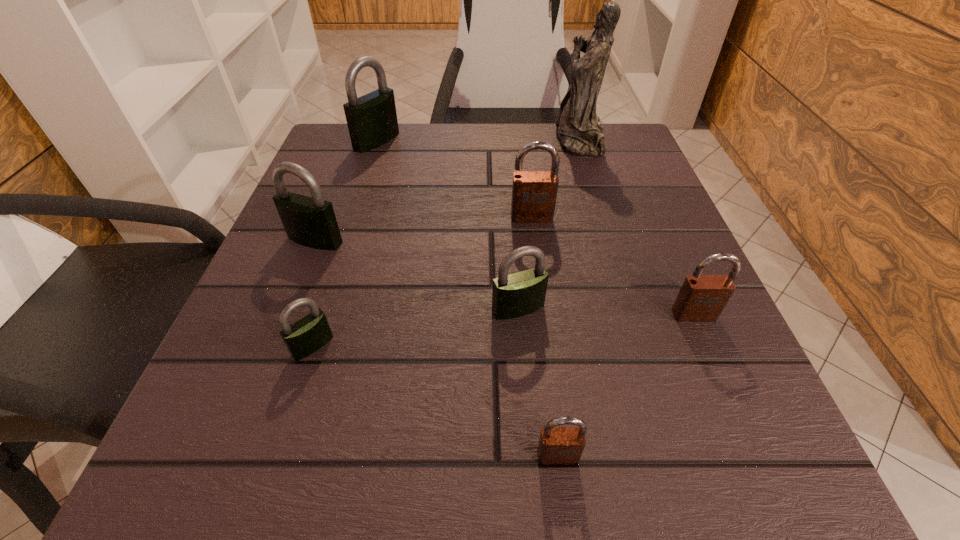
I want to click on free region located 0.240m on the right of the second biggest black padlock, so click(485, 240).

Image resolution: width=960 pixels, height=540 pixels. In order to click on free space located 0.150m on the front-facing side of the second farthest padlock in this screenshot , I will do `click(540, 285)`.

Image resolution: width=960 pixels, height=540 pixels. What are the coordinates of `vacant point located 0.140m on the front-facing side of the rightmost padlock` in the screenshot? It's located at (736, 413).

Find the location of a particular element. The width and height of the screenshot is (960, 540). blank space located 0.130m on the right of the second smallest black padlock is located at coordinates (634, 308).

Where is `free space located on the back of the smallest black padlock`? The height and width of the screenshot is (540, 960). free space located on the back of the smallest black padlock is located at coordinates (356, 209).

This screenshot has height=540, width=960. What are the coordinates of `figurine that is at the far edge` in the screenshot? It's located at (579, 130).

Locate an element on the screen. padlock that is at the far edge is located at coordinates (372, 121).

Where is `object that is at the near edge`? The width and height of the screenshot is (960, 540). object that is at the near edge is located at coordinates (557, 445).

The height and width of the screenshot is (540, 960). In order to click on figurine located in the right edge section of the desktop in this screenshot , I will do `click(579, 130)`.

At what (x,y) coordinates should I click in order to perform the action: click on padlock present at the right edge. Please return your answer as a coordinate pair (x, y). Image resolution: width=960 pixels, height=540 pixels. Looking at the image, I should click on pos(702,297).